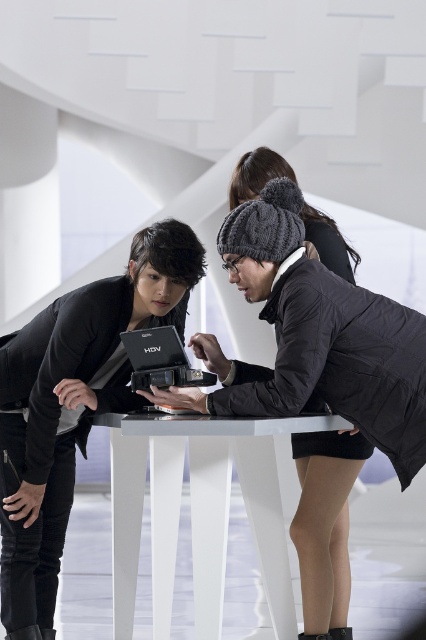
You are trying to place a new keyboard that is the same size as the black matte laptop at left onto the white glossy table at center. Will the keyboard fit on the table?

The black matte laptop at left is smaller than the white glossy table at center, so the keyboard, being the same size as the laptop, will fit on the table.

You are standing in front of the white glossy table at center and the black matte laptop at center. Which object is closer to you?

The white glossy table at center is closer to you because it is in front of the black matte laptop at center.

You are trying to place a new keyboard on the table. The keyboard needs to be placed below the black matte laptop at left but still on the white glossy table at center. Is this possible?

The black matte laptop at left is located above the white glossy table at center, so placing the keyboard below the laptop but still on the table is possible as the laptop is on the table and the keyboard can be placed under it while remaining on the table.